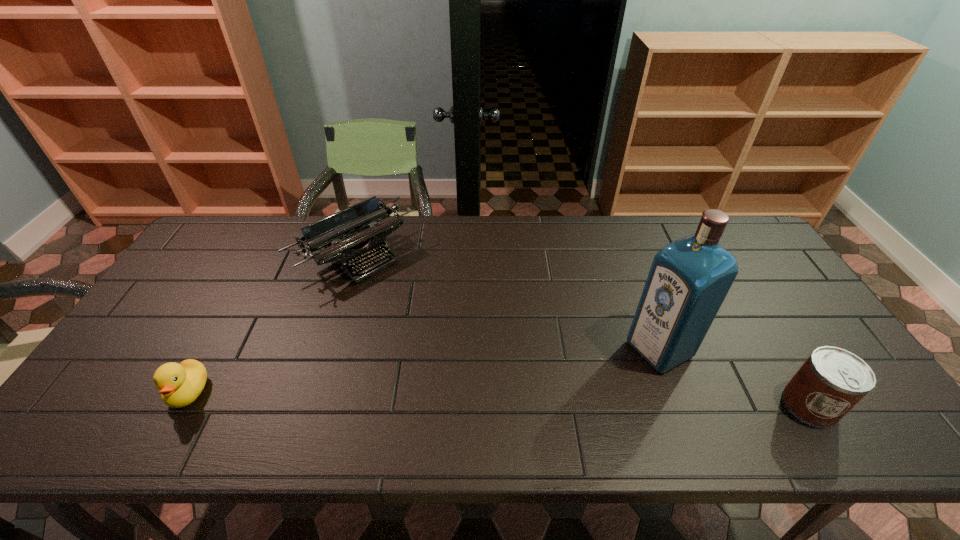
At what (x,y) coordinates should I click in order to perform the action: click on the leftmost object. Please return your answer as a coordinate pair (x, y). The height and width of the screenshot is (540, 960). Looking at the image, I should click on (180, 384).

Find the location of a particular element. This screenshot has width=960, height=540. duckling is located at coordinates (180, 384).

At what (x,y) coordinates should I click in order to perform the action: click on can. Please return your answer as a coordinate pair (x, y). Looking at the image, I should click on (832, 380).

Locate an element on the screen. The height and width of the screenshot is (540, 960). the third object from left to right is located at coordinates (689, 278).

The width and height of the screenshot is (960, 540). In order to click on the tallest object in this screenshot , I will do `click(689, 278)`.

Identify the location of the third object from right to left. The height and width of the screenshot is (540, 960). (358, 226).

This screenshot has height=540, width=960. In order to click on the farthest object in this screenshot , I will do `click(358, 226)`.

Locate an element on the screen. vacant position located on the back of the can is located at coordinates [x=758, y=321].

Find the location of a particular element. Image resolution: width=960 pixels, height=540 pixels. free region located on the flat label side of the second object from right to left is located at coordinates (614, 373).

The width and height of the screenshot is (960, 540). I want to click on free space located 0.120m on the flat label side of the second object from right to left, so click(x=598, y=382).